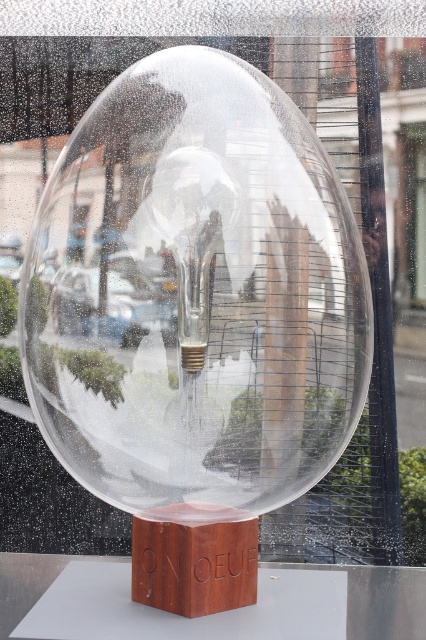
Question: Which point is farther to the camera?

Choices:
 (A) wooden cube at center
 (B) transparent glass bubble at center

Answer: (A)

Question: Can you confirm if transparent glass bubble at center is positioned above wooden cube at center?

Choices:
 (A) yes
 (B) no

Answer: (A)

Question: Is transparent glass bubble at center wider than wooden cube at center?

Choices:
 (A) yes
 (B) no

Answer: (A)

Question: Which object is closer to the camera taking this photo?

Choices:
 (A) wooden cube at center
 (B) transparent glass bubble at center

Answer: (B)

Question: Which point appears closest to the camera in this image?

Choices:
 (A) (317, 204)
 (B) (195, 548)

Answer: (A)

Question: Considering the relative positions of transparent glass bubble at center and wooden cube at center in the image provided, where is transparent glass bubble at center located with respect to wooden cube at center?

Choices:
 (A) right
 (B) left

Answer: (A)